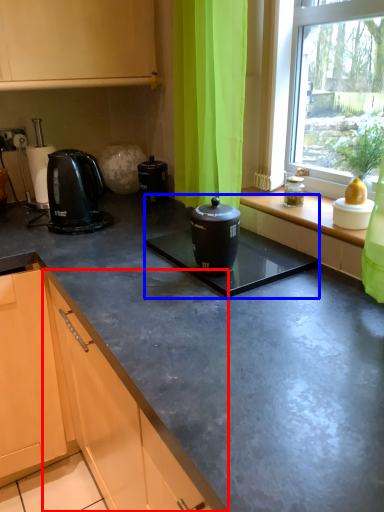
Question: Which point is further to the camera, cabinetry (highlighted by a red box) or sink (highlighted by a blue box)?

Choices:
 (A) cabinetry
 (B) sink

Answer: (A)